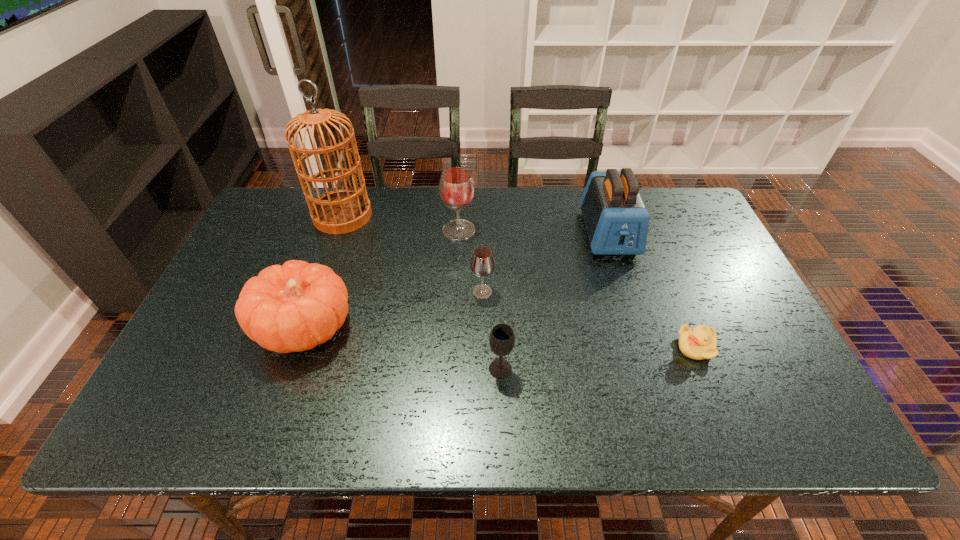
This screenshot has height=540, width=960. I want to click on vacant space located on the right of the farthest wineglass, so click(524, 230).

Find the location of a particular element. vacant space located 0.070m on the left of the pumpkin is located at coordinates (228, 328).

Where is `free space located 0.340m on the back of the second nearest wineglass`? This screenshot has width=960, height=540. free space located 0.340m on the back of the second nearest wineglass is located at coordinates (482, 207).

Find the location of a particular element. Image resolution: width=960 pixels, height=540 pixels. free space located on the right of the nearest wineglass is located at coordinates (552, 369).

You are a GUI agent. You are given a task and a screenshot of the screen. Output one action in this format:
    pyautogui.click(x=<x>, y=<y>)
    Task: Click on the vacant space located on the front-facing side of the shortest object
    This screenshot has height=540, width=960.
    Given the screenshot: What is the action you would take?
    pyautogui.click(x=535, y=347)

Identify the location of free point located 0.110m on the front-facing side of the shortest object. The image size is (960, 540). (631, 347).

Identify the location of free location located 0.080m on the front-facing side of the shortest object. (643, 347).

Locate an element on the screen. Image resolution: width=960 pixels, height=540 pixels. birdcage that is at the far edge is located at coordinates (342, 211).

Where is `toaster located at the far edge`? toaster located at the far edge is located at coordinates (616, 219).

At what (x,y) coordinates should I click in order to perform the action: click on wineglass at the far edge. Please return your answer as a coordinate pair (x, y). The height and width of the screenshot is (540, 960). Looking at the image, I should click on (456, 187).